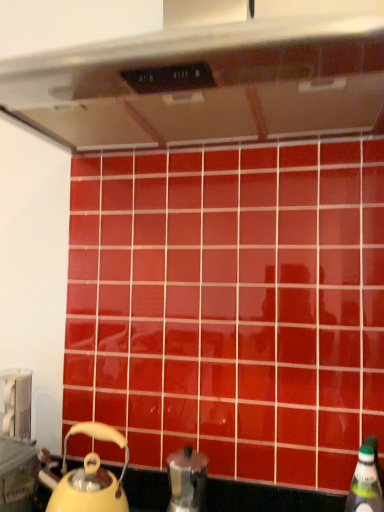
In order to click on green plastic bottle at lower right in this screenshot , I will do `click(365, 484)`.

Where is `satin silver exhaust hood at upper center`? The image size is (384, 512). satin silver exhaust hood at upper center is located at coordinates (206, 84).

Is yellow matte kettle at lower left shorter than metallic silver toaster at lower left?

In fact, yellow matte kettle at lower left may be taller than metallic silver toaster at lower left.

You are a GUI agent. You are given a task and a screenshot of the screen. Output one action in this format:
    pyautogui.click(x=<x>, y=<y>)
    Task: Click on the kettle below the metallic silver toaster at lower left (from the image's perspective)
    
    Given the screenshot: What is the action you would take?
    pyautogui.click(x=89, y=477)

Is yellow matte kettle at lower left at the left side of metallic silver toaster at lower left?

Incorrect, yellow matte kettle at lower left is not on the left side of metallic silver toaster at lower left.

From the picture: Considering the sizes of objects metallic silver coffee pot at lower center and yellow matte kettle at lower left in the image provided, who is taller, metallic silver coffee pot at lower center or yellow matte kettle at lower left?

yellow matte kettle at lower left is taller.

This screenshot has width=384, height=512. I want to click on kettle above the metallic silver coffee pot at lower center (from the image's perspective), so [x=89, y=477].

In the image, is metallic silver coffee pot at lower center on the left side or the right side of yellow matte kettle at lower left?

From the image, it's evident that metallic silver coffee pot at lower center is to the right of yellow matte kettle at lower left.

Which object is further away from the camera, metallic silver coffee pot at lower center or yellow matte kettle at lower left?

Positioned behind is metallic silver coffee pot at lower center.

From the image's perspective, would you say metallic silver coffee pot at lower center is positioned over green plastic bottle at lower right?

Yes, from the image's perspective, metallic silver coffee pot at lower center is over green plastic bottle at lower right.

From a real-world perspective, is metallic silver coffee pot at lower center physically above green plastic bottle at lower right?

Yes, from a real-world perspective, metallic silver coffee pot at lower center is above green plastic bottle at lower right.

Which is farther from the camera, (202, 475) or (349, 510)?

Positioned behind is point (349, 510).

Considering the positions of objects metallic silver coffee pot at lower center and green plastic bottle at lower right in the image provided, who is in front, metallic silver coffee pot at lower center or green plastic bottle at lower right?

green plastic bottle at lower right is in front.

Which object is thinner, metallic silver coffee pot at lower center or metallic silver toaster at lower left?

metallic silver toaster at lower left is thinner.

Would you say metallic silver coffee pot at lower center contains metallic silver toaster at lower left?

Actually, metallic silver toaster at lower left is outside metallic silver coffee pot at lower center.

From the picture: Is metallic silver coffee pot at lower center aimed at metallic silver toaster at lower left?

No, metallic silver coffee pot at lower center is not turned towards metallic silver toaster at lower left.

The height and width of the screenshot is (512, 384). Find the location of `appliance located above the metallic silver coffee pot at lower center (from the image's perspective)`. appliance located above the metallic silver coffee pot at lower center (from the image's perspective) is located at coordinates (17, 402).

The height and width of the screenshot is (512, 384). In order to click on kitchen appliance behind the satin silver exhaust hood at upper center in this screenshot , I will do `click(187, 480)`.

Is metallic silver coffee pot at lower center placed right next to satin silver exhaust hood at upper center?

metallic silver coffee pot at lower center and satin silver exhaust hood at upper center are clearly separated.

Is metallic silver coffee pot at lower center at the right side of satin silver exhaust hood at upper center?

In fact, metallic silver coffee pot at lower center is to the left of satin silver exhaust hood at upper center.

In the scene shown: From a real-world perspective, between metallic silver coffee pot at lower center and satin silver exhaust hood at upper center, who is vertically higher?

In real-world perspective, satin silver exhaust hood at upper center is above.

Which object is thinner, green plastic bottle at lower right or metallic silver coffee pot at lower center?

green plastic bottle at lower right.

Is point (359, 468) farther from viewer compared to point (192, 476)?

That is False.

Locate an element on the screen. This screenshot has width=384, height=512. kitchen appliance above the green plastic bottle at lower right (from a real-world perspective) is located at coordinates (187, 480).

From the picture: Considering the sizes of objects green plastic bottle at lower right and metallic silver coffee pot at lower center in the image provided, who is smaller, green plastic bottle at lower right or metallic silver coffee pot at lower center?

green plastic bottle at lower right is smaller.

Consider the image. Does green plastic bottle at lower right come in front of satin silver exhaust hood at upper center?

No, green plastic bottle at lower right is further to the viewer.

From the image's perspective, is green plastic bottle at lower right located above or below satin silver exhaust hood at upper center?

Based on their image positions, green plastic bottle at lower right is located beneath satin silver exhaust hood at upper center.

Which is more to the right, green plastic bottle at lower right or satin silver exhaust hood at upper center?

green plastic bottle at lower right.

Is green plastic bottle at lower right oriented towards satin silver exhaust hood at upper center?

No, green plastic bottle at lower right is not facing towards satin silver exhaust hood at upper center.

The image size is (384, 512). In order to click on kettle that is below the metallic silver toaster at lower left (from the image's perspective) in this screenshot , I will do `click(89, 477)`.

At what (x,y) coordinates should I click in order to perform the action: click on kettle on the left of the metallic silver coffee pot at lower center. Please return your answer as a coordinate pair (x, y). This screenshot has width=384, height=512. Looking at the image, I should click on (89, 477).

Estimate the real-world distances between objects in this image. Which object is closer to green plastic bottle at lower right, yellow matte kettle at lower left or metallic silver toaster at lower left?

Based on the image, yellow matte kettle at lower left appears to be nearer to green plastic bottle at lower right.

Which object lies further to the anchor point green plastic bottle at lower right, yellow matte kettle at lower left or satin silver exhaust hood at upper center?

The object further to green plastic bottle at lower right is satin silver exhaust hood at upper center.

From the picture: Looking at the image, which one is located closer to yellow matte kettle at lower left, green plastic bottle at lower right or metallic silver toaster at lower left?

metallic silver toaster at lower left is positioned closer to the anchor yellow matte kettle at lower left.

Estimate the real-world distances between objects in this image. Which object is further from metallic silver coffee pot at lower center, yellow matte kettle at lower left or metallic silver toaster at lower left?

metallic silver toaster at lower left.

Looking at the image, which one is located further to metallic silver coffee pot at lower center, green plastic bottle at lower right or yellow matte kettle at lower left?

Among the two, green plastic bottle at lower right is located further to metallic silver coffee pot at lower center.

Which object lies further to the anchor point satin silver exhaust hood at upper center, yellow matte kettle at lower left or metallic silver coffee pot at lower center?

metallic silver coffee pot at lower center is positioned further to the anchor satin silver exhaust hood at upper center.

Looking at the image, which one is located further to satin silver exhaust hood at upper center, metallic silver toaster at lower left or green plastic bottle at lower right?

green plastic bottle at lower right lies further to satin silver exhaust hood at upper center than the other object.

Which object lies nearer to the anchor point satin silver exhaust hood at upper center, green plastic bottle at lower right or yellow matte kettle at lower left?

yellow matte kettle at lower left is positioned closer to the anchor satin silver exhaust hood at upper center.

Locate an element on the screen. This screenshot has height=512, width=384. appliance between satin silver exhaust hood at upper center and green plastic bottle at lower right in the up-down direction is located at coordinates tap(17, 402).

Locate an element on the screen. The image size is (384, 512). kettle that lies between satin silver exhaust hood at upper center and metallic silver coffee pot at lower center from top to bottom is located at coordinates (89, 477).

Identify the location of kitchen appliance between satin silver exhaust hood at upper center and green plastic bottle at lower right from top to bottom. The width and height of the screenshot is (384, 512). (187, 480).

Image resolution: width=384 pixels, height=512 pixels. I want to click on appliance between satin silver exhaust hood at upper center and metallic silver coffee pot at lower center in the vertical direction, so click(17, 402).